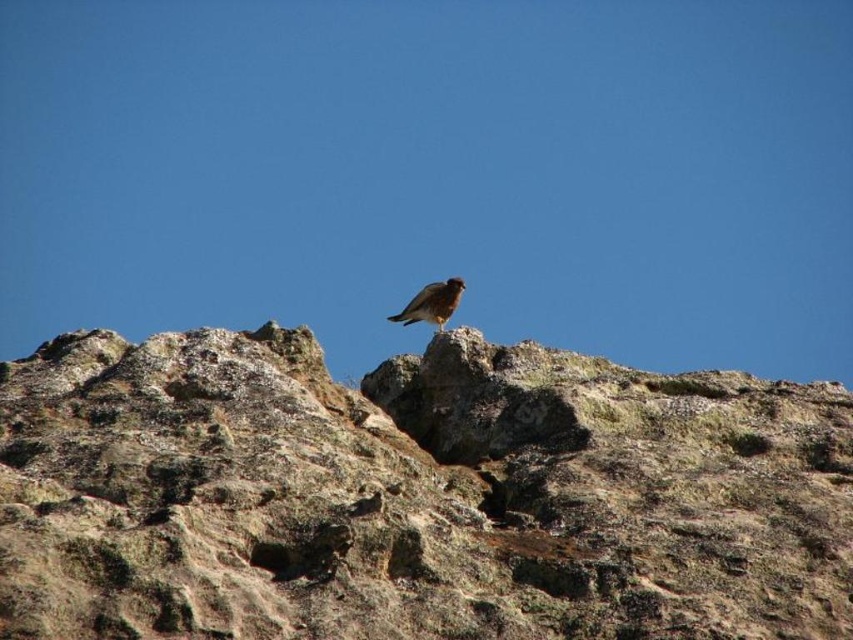
You are a hiker who has spotted the brown feathered bird at upper center perched on the brown rough rock at center. You want to take a photo of the bird without disturbing it. If your camera has a zoom range of 100 feet, can you capture the bird from your current position?

The brown rough rock at center is 80.25 feet away from the brown feathered bird at upper center. Since your camera can zoom up to 100 feet, you can capture the bird from your current position as the distance is within the camera range.

You are an ornithologist observing the brown feathered bird at upper center perched on the brown rough rock at center. Based on their positions, can you determine if the bird is sitting on top of the rock?

The brown rough rock at center is below the brown feathered bird at upper center, so yes, the bird is sitting on top of the rock.